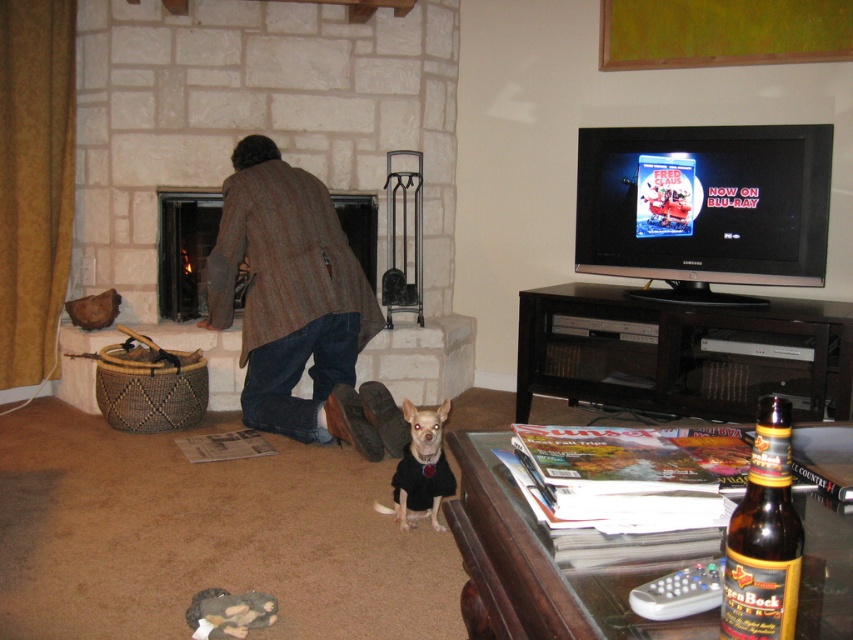
Question: Does brown glass beer bottle at lower right lie in front of brown woolen fireplace at center?

Choices:
 (A) yes
 (B) no

Answer: (A)

Question: Which point is farther from the camera taking this photo?

Choices:
 (A) (421, 410)
 (B) (761, 413)
 (C) (368, 256)
 (D) (292, 353)

Answer: (C)

Question: Is brown wool coat at center to the right of white fur dog at center from the viewer's perspective?

Choices:
 (A) yes
 (B) no

Answer: (B)

Question: Which is farther from the brown glass beer bottle at lower right?

Choices:
 (A) brown woolen fireplace at center
 (B) brown wool coat at center

Answer: (A)

Question: Is brown wool coat at center smaller than brown glass beer bottle at lower right?

Choices:
 (A) no
 (B) yes

Answer: (A)

Question: Which object is farther from the camera taking this photo?

Choices:
 (A) brown woolen fireplace at center
 (B) white fur dog at center
 (C) brown wool coat at center
 (D) brown glass beer bottle at lower right

Answer: (A)